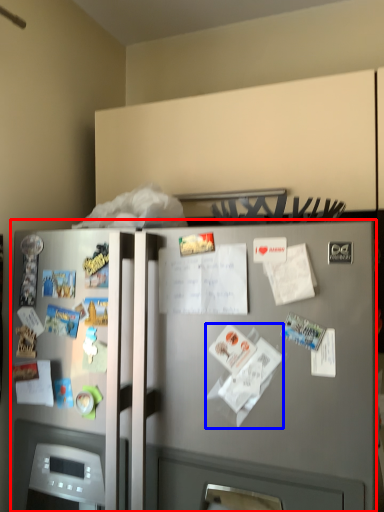
Question: Which of the following is the farthest to the observer, refrigerator (highlighted by a red box) or paper (highlighted by a blue box)?

Choices:
 (A) refrigerator
 (B) paper

Answer: (B)